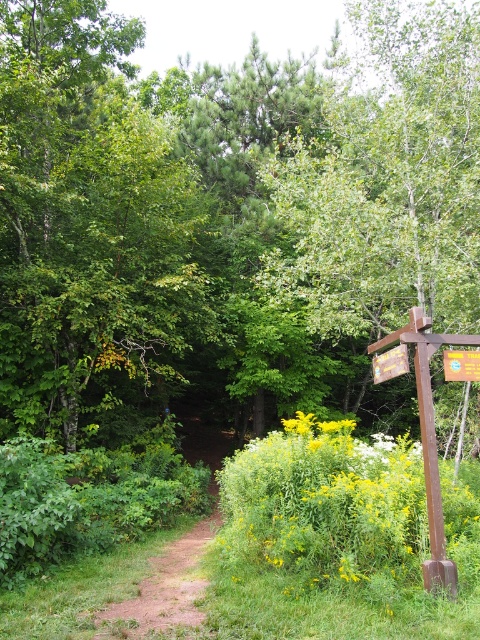
You are navigating a forest path and see two points marked on your map. The first point is at coordinate point (252, 467) and the second is at point (441, 516). If you are standing at the first point, which direction should you walk to reach the second point?

Since point (252, 467) is behind point (441, 516), you should walk forward towards the direction of point (441, 516) to reach it from your current position at point (252, 467).

You are a hiker navigating the forest path and want to determine your position relative to two landmarks. The first landmark is at point (x=462, y=374), and the second is at point (x=384, y=362). Which point is closer to your current position if you are standing at the camera position?

Point (x=462, y=374) is closer to the camera than point (x=384, y=362), so the first landmark is closer to your current position.